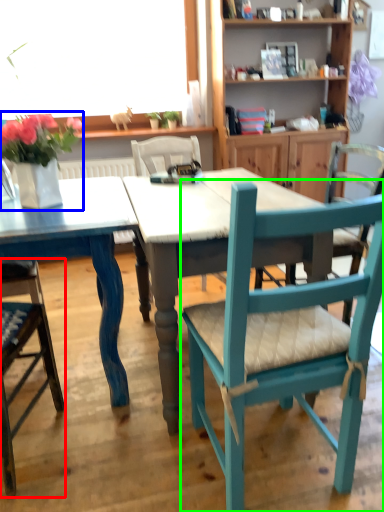
Question: Based on their relative distances, which object is nearer to chair (highlighted by a red box)? Choose from floral arrangement (highlighted by a blue box) and chair (highlighted by a green box).

Choices:
 (A) floral arrangement
 (B) chair

Answer: (A)